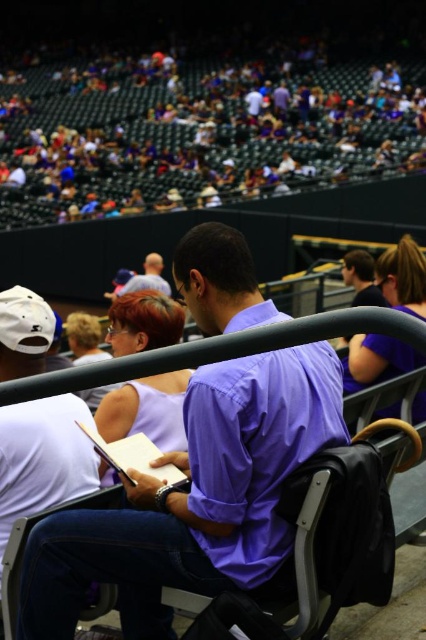
You are an event organizer at the stadium and need to arrange seating for two VIP guests. There is a matte purple dress at center and a purple fabric shirt at upper right. Which guest should be seated closer to the front for better visibility?

The purple fabric shirt at upper right should be seated closer to the front because it is located above the matte purple dress at center, indicating a higher position in the seating arrangement.

You are attending a sports event and notice two items in the crowd. The first is a white matte baseball cap at left and the second is a light blue shirt at center. Which item takes up more visual space in the image?

The white matte baseball cap at left takes up more visual space in the image because it has a larger size compared to the light blue shirt at center.

You are an event planner at the stadium and need to arrange two purple items for a photoshoot. The matte purple shirt at center and the matte purple dress at center must be placed in specific positions. Based on the scene description, which item is farther from the camera?

The matte purple dress at center is farther from the camera because the matte purple shirt at center is only 46.36 meters away from it, implying the shirt is closer to the camera while the dress is positioned further back.